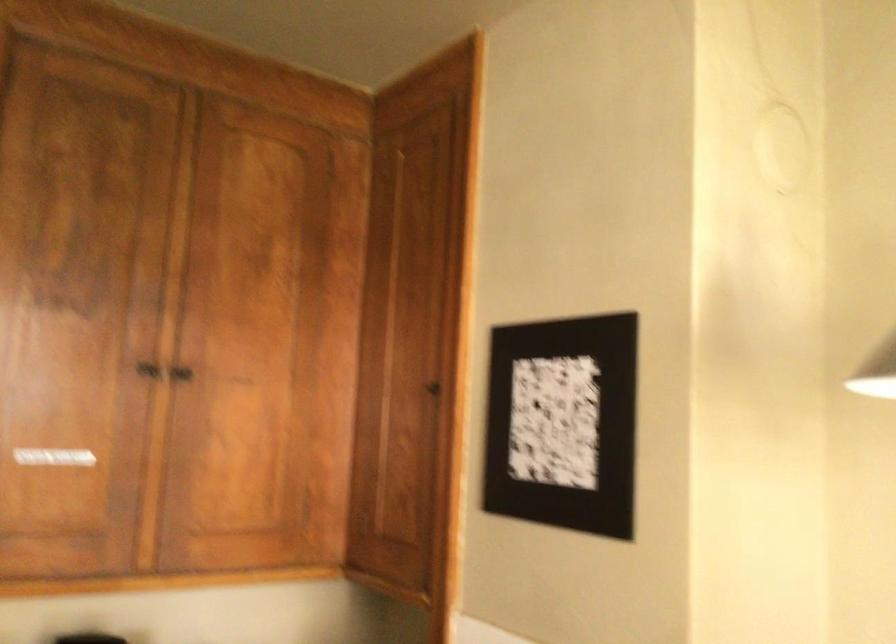
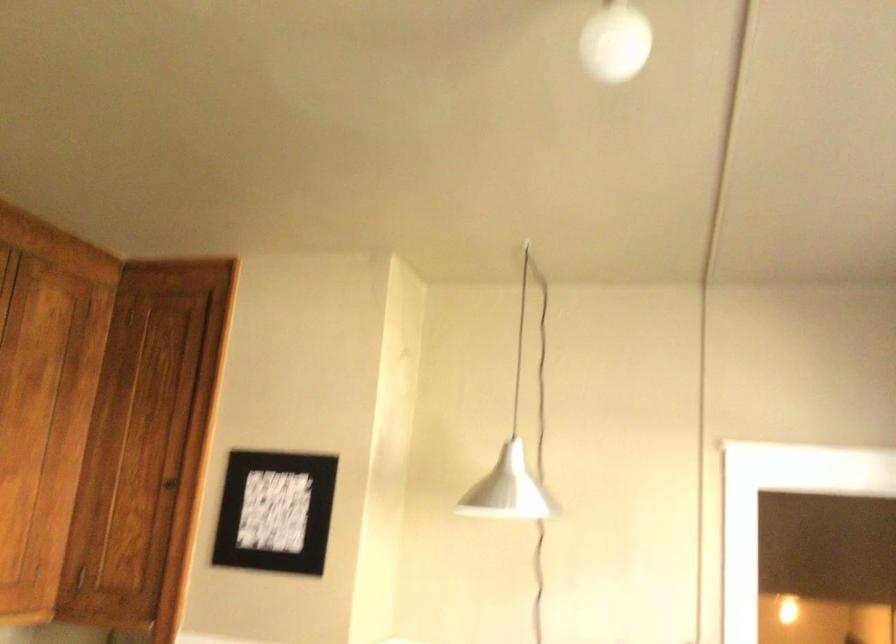
Locate, in the second image, the point that corresponds to [243,281] in the first image.

(23, 397)